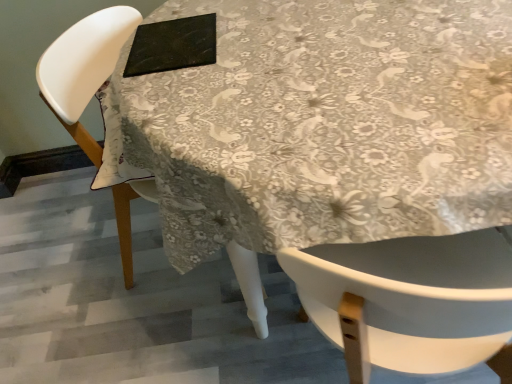
Question: Should I look upward or downward to see white plastic chair at upper left?

Choices:
 (A) down
 (B) up

Answer: (B)

Question: From the image's perspective, would you say white glossy table at center is positioned over black matte pad at upper center?

Choices:
 (A) no
 (B) yes

Answer: (A)

Question: Does white glossy table at center lie in front of black matte pad at upper center?

Choices:
 (A) yes
 (B) no

Answer: (A)

Question: Is white glossy table at center outside black matte pad at upper center?

Choices:
 (A) no
 (B) yes

Answer: (B)

Question: Does white glossy table at center have a greater width compared to black matte pad at upper center?

Choices:
 (A) yes
 (B) no

Answer: (A)

Question: Is white glossy table at center bigger than black matte pad at upper center?

Choices:
 (A) no
 (B) yes

Answer: (B)

Question: Does white glossy table at center have a smaller size compared to black matte pad at upper center?

Choices:
 (A) yes
 (B) no

Answer: (B)

Question: Is white glossy table at center surrounding white plastic chair at upper left?

Choices:
 (A) yes
 (B) no

Answer: (A)

Question: Does white glossy table at center have a greater height compared to white plastic chair at upper left?

Choices:
 (A) no
 (B) yes

Answer: (B)

Question: Considering the relative positions of white glossy table at center and white plastic chair at upper left in the image provided, is white glossy table at center behind white plastic chair at upper left?

Choices:
 (A) no
 (B) yes

Answer: (A)

Question: Does white glossy table at center appear on the left side of white plastic chair at upper left?

Choices:
 (A) yes
 (B) no

Answer: (B)

Question: Is white glossy table at center facing towards white plastic chair at upper left?

Choices:
 (A) yes
 (B) no

Answer: (B)

Question: From a real-world perspective, is white glossy table at center under white plastic chair at upper left?

Choices:
 (A) no
 (B) yes

Answer: (B)

Question: Can you confirm if black matte pad at upper center is shorter than white plastic chair at upper left?

Choices:
 (A) yes
 (B) no

Answer: (A)